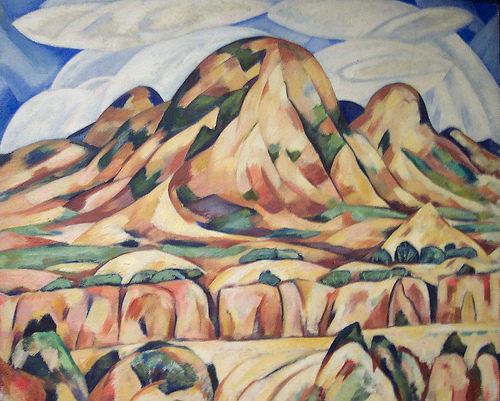
This screenshot has width=500, height=401. I want to click on painting, so click(x=184, y=153).